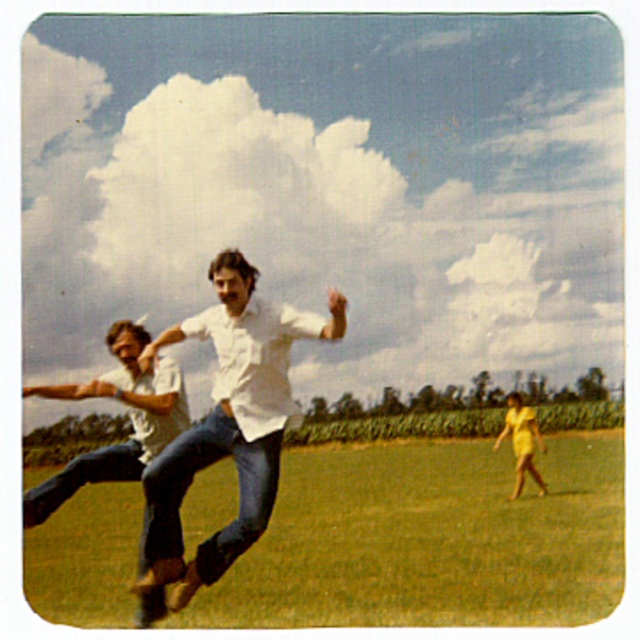
In the lively outdoor scene with a partly cloudy sky, there are two people in the foreground wearing a white cotton shirt at center and denim jeans at center. Which clothing item is taller?

The white cotton shirt at center is taller than the denim jeans at center.